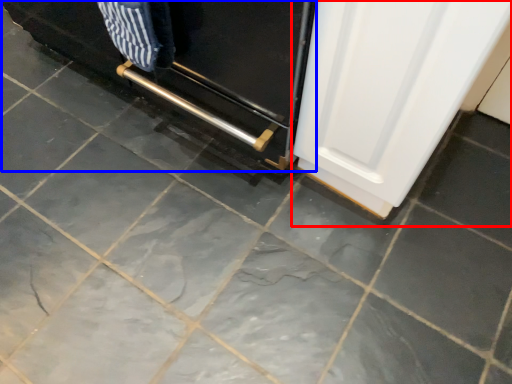
Question: Which point is further to the camera, door (highlighted by a red box) or oven (highlighted by a blue box)?

Choices:
 (A) door
 (B) oven

Answer: (B)